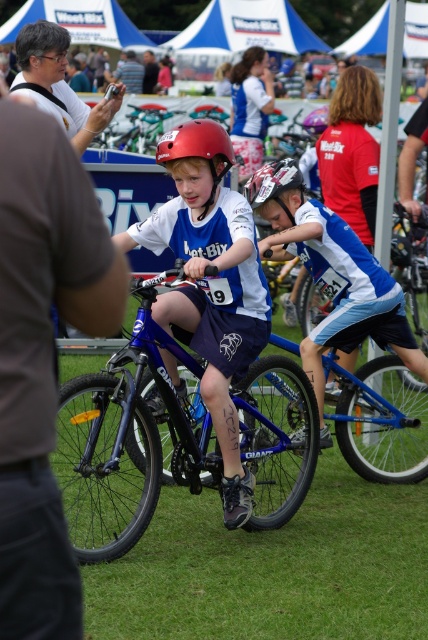
You are a photographer at a cycling event. You need to capture a photo that includes both the brown fabric shirt at left and the matte blue jersey at center. Which one should you adjust your camera focus to prioritize if you want the one closer to you to be in focus?

The brown fabric shirt at left is in front of the matte blue jersey at center, so you should prioritize focusing on the brown fabric shirt at left to ensure it is in focus since it is closer to you.

You are a photographer at the cycling event. You want to take a photo that includes both the brown fabric shirt at left and the shiny red helmet at center. Which object should you zoom in on to ensure both are clearly visible in the frame?

To ensure both the brown fabric shirt at left and the shiny red helmet at center are clearly visible, you should zoom in on the shiny red helmet at center because it is smaller than the brown fabric shirt at left.

You are a photographer at the cycling event and want to capture a photo of both the blue metallic bicycle at center and the matte blue jersey at center in the same frame. Based on their positions, which object should you position closer to the left side of your camera viewfinder to include both?

The blue metallic bicycle at center is to the left of the matte blue jersey at center, so to include both in the frame, position the blue metallic bicycle at center closer to the left side of the camera viewfinder.